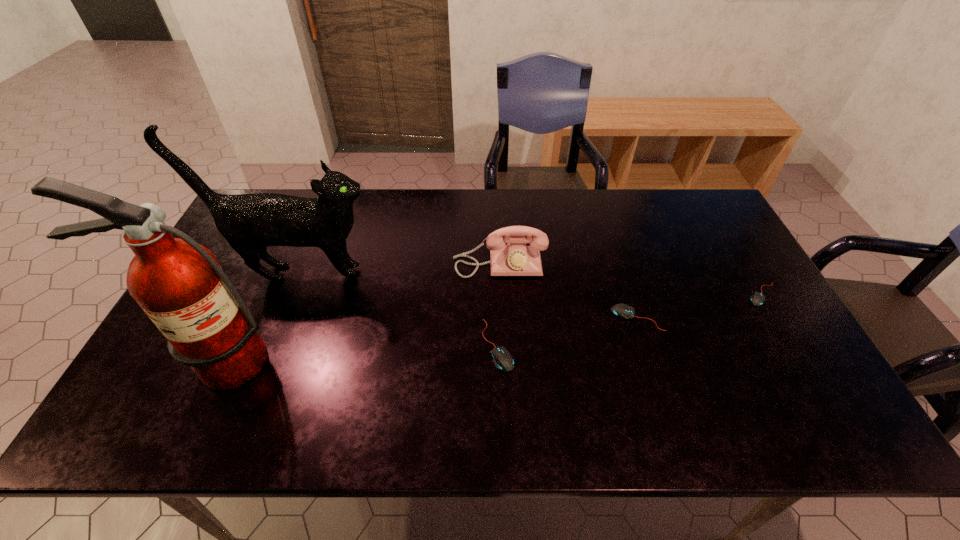
At what (x,y) coordinates should I click in order to perform the action: click on free space at the near edge. Please return your answer as a coordinate pair (x, y). The image size is (960, 540). Looking at the image, I should click on (603, 390).

This screenshot has height=540, width=960. In the image, there is a desktop. In order to click on free region at the left edge in this screenshot , I will do `click(246, 278)`.

Identify the location of vacant space at the near left corner of the desktop. (165, 394).

In order to click on vacant area that lies between the fire extinguisher and the second mouse from right to left in this screenshot , I will do `click(428, 340)`.

At what (x,y) coordinates should I click in order to perform the action: click on empty space between the telephone and the fifth object from left to right. Please return your answer as a coordinate pair (x, y). The height and width of the screenshot is (540, 960). Looking at the image, I should click on (568, 291).

Image resolution: width=960 pixels, height=540 pixels. Find the location of `vacant area between the cat and the second object from right to left`. vacant area between the cat and the second object from right to left is located at coordinates (469, 295).

Find the location of a particular element. empty location between the leftmost mouse and the cat is located at coordinates (399, 309).

Identify the location of vacant space that's between the leftmost mouse and the rightmost mouse. (631, 320).

The image size is (960, 540). I want to click on vacant space that is in between the fire extinguisher and the cat, so click(260, 318).

Locate an element on the screen. free spot between the leftmost mouse and the fire extinguisher is located at coordinates (358, 353).